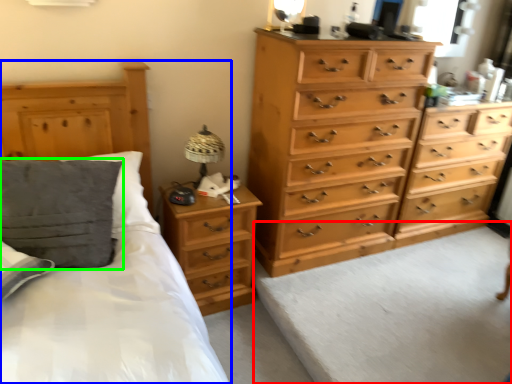
Question: Which object is the closest to the plain (highlighted by a red box)? Choose among these: bed (highlighted by a blue box) or pillow (highlighted by a green box).

Choices:
 (A) bed
 (B) pillow

Answer: (A)